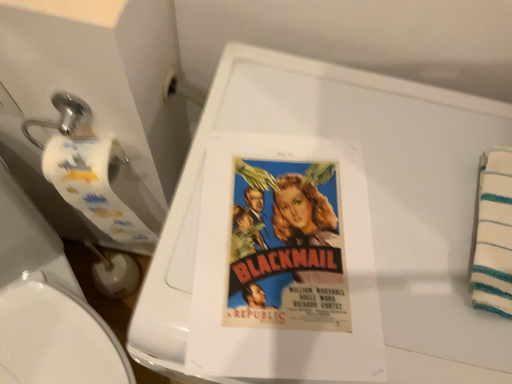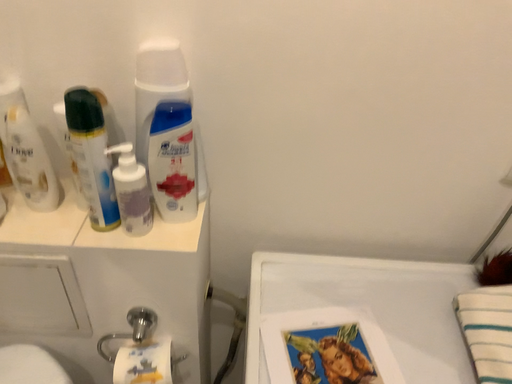
Question: Which way did the camera rotate in the video?

Choices:
 (A) rotated upward
 (B) rotated downward

Answer: (A)